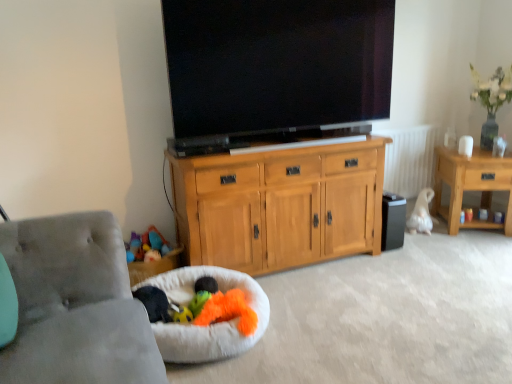
Image resolution: width=512 pixels, height=384 pixels. In order to click on free point above white textured radiator at right (from a real-world perspective) in this screenshot , I will do `click(400, 126)`.